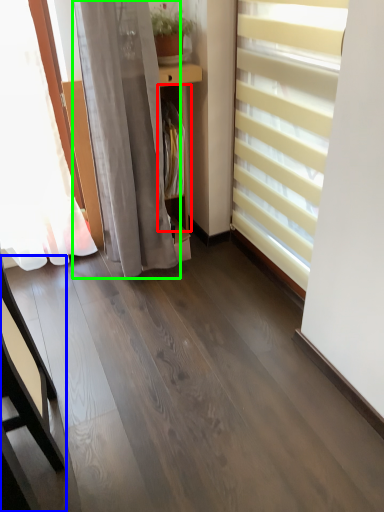
Question: Which is farther away from shelf (highlighted by a red box)? furniture (highlighted by a blue box) or curtain (highlighted by a green box)?

Choices:
 (A) furniture
 (B) curtain

Answer: (A)